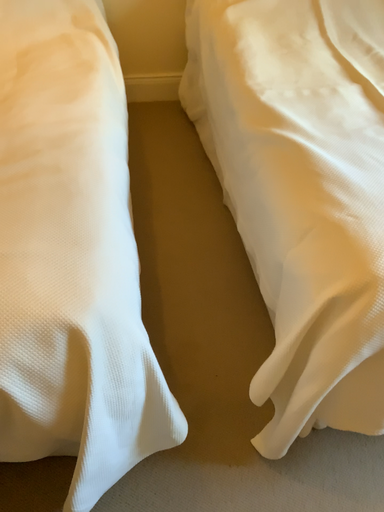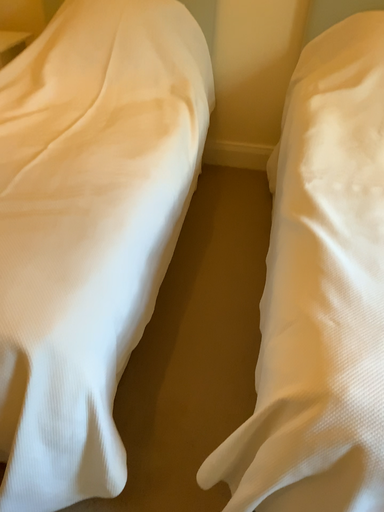
Question: How did the camera likely rotate when shooting the video?

Choices:
 (A) rotated right
 (B) rotated left

Answer: (B)